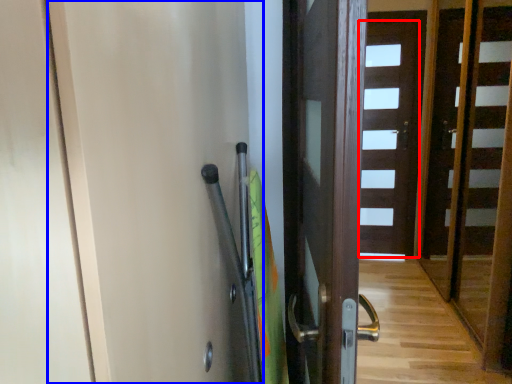
Question: Which object appears farthest to the camera in this image, door (highlighted by a red box) or screen door (highlighted by a blue box)?

Choices:
 (A) door
 (B) screen door

Answer: (A)